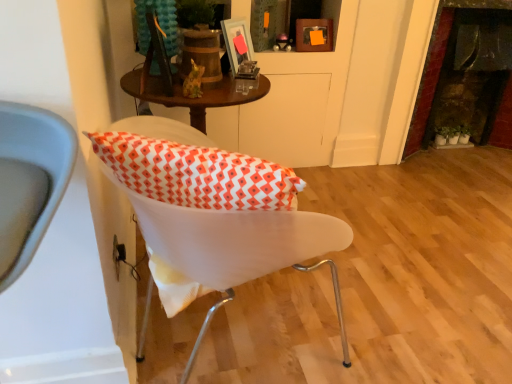
Question: Considering the positions of metallic silver picture frame at upper center, which is the first picture frame in front-to-back order, and green matte plant at right in the image, is metallic silver picture frame at upper center, which is the first picture frame in front-to-back order, wider or thinner than green matte plant at right?

Choices:
 (A) thin
 (B) wide

Answer: (A)

Question: Would you say metallic silver picture frame at upper center, which is the 1th picture frame in left-to-right order, is to the left or to the right of green matte plant at right in the picture?

Choices:
 (A) left
 (B) right

Answer: (A)

Question: Considering the real-world distances, which object is farthest from the green matte plant at right?

Choices:
 (A) white plastic chair at center
 (B) wooden picture frame at upper center, which is counted as the first picture frame, starting from the back
 (C) matte glass picture frame at upper center, which is the second picture frame in back-to-front order
 (D) metallic silver picture frame at upper center, which is the third picture frame in back-to-front order
 (E) dark stone fireplace at right

Answer: (A)

Question: Estimate the real-world distances between objects in this image. Which object is farther from the metallic silver picture frame at upper center, which is the third picture frame in back-to-front order?

Choices:
 (A) dark stone fireplace at right
 (B) matte glass picture frame at upper center, which is the 2th picture frame in left-to-right order
 (C) white plastic chair at center
 (D) wooden picture frame at upper center, marked as the 3th picture frame in a left-to-right arrangement
 (E) green matte plant at right

Answer: (E)